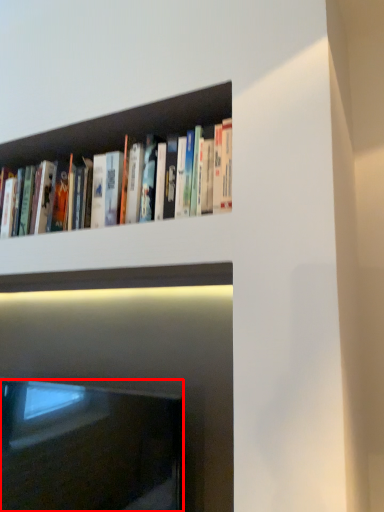
Question: From the image's perspective, where is fireplace (annotated by the red box) located in relation to book in the image?

Choices:
 (A) above
 (B) below

Answer: (B)